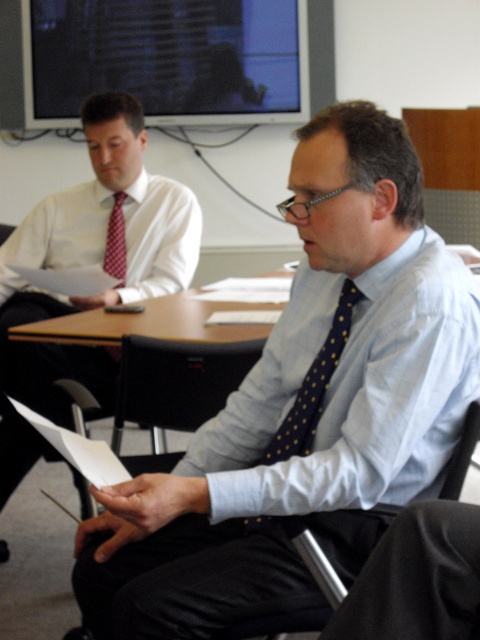
Question: Estimate the real-world distances between objects in this image. Which object is closer to the red textured tie at left?

Choices:
 (A) polka dot tie at center
 (B) matte white shirt at left
 (C) black fabric chair at center

Answer: (B)

Question: Which of the following is the farthest from the observer?

Choices:
 (A) (130, 394)
 (B) (117, 252)
 (C) (8, 259)

Answer: (B)

Question: Which object is farther from the camera taking this photo?

Choices:
 (A) polka dot tie at center
 (B) matte white shirt at left
 (C) red textured tie at left

Answer: (C)

Question: Does polka dot tie at center have a lesser width compared to black fabric chair at center?

Choices:
 (A) yes
 (B) no

Answer: (B)

Question: Does matte white shirt at left appear under black fabric chair at center?

Choices:
 (A) no
 (B) yes

Answer: (A)

Question: Does black fabric chair at center lie in front of red textured tie at left?

Choices:
 (A) no
 (B) yes

Answer: (B)